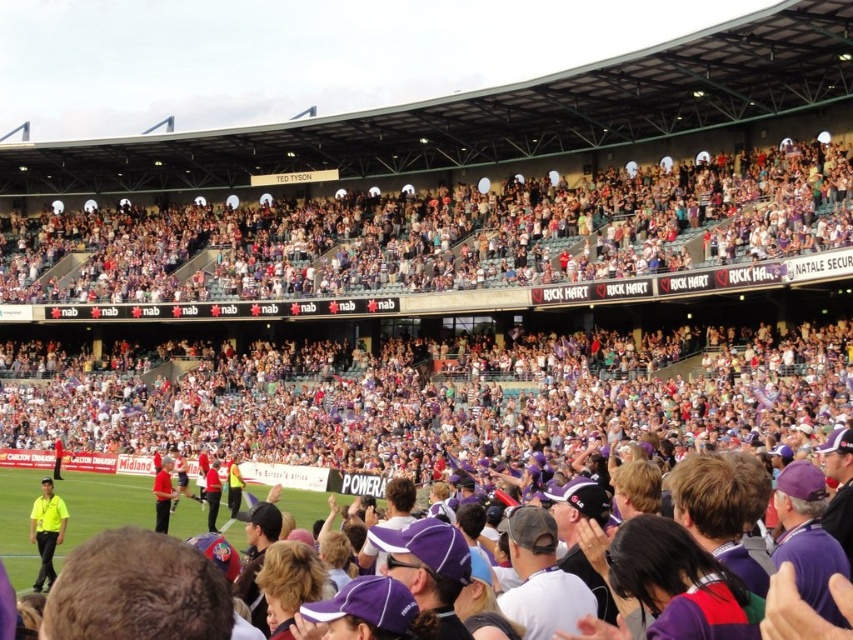
Question: Can you confirm if yellow shirt at lower left is bigger than matte red shirt at center?

Choices:
 (A) yes
 (B) no

Answer: (A)

Question: Which point is farther from the camera taking this photo?

Choices:
 (A) (33, 525)
 (B) (161, 499)

Answer: (B)

Question: Can you confirm if yellow shirt at lower left is wider than matte red shirt at center?

Choices:
 (A) no
 (B) yes

Answer: (B)

Question: Does yellow shirt at lower left appear on the right side of matte red shirt at center?

Choices:
 (A) no
 (B) yes

Answer: (A)